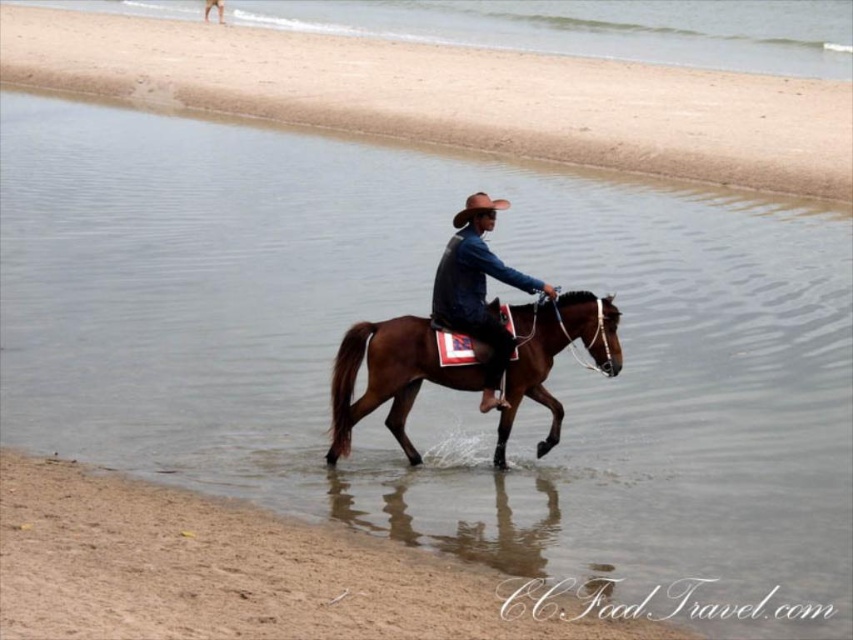
You are a photographer planning to take a photo of the scene. You want to ensure that both the brown glossy horse at center and the brown leather cowboy hat at center are clearly visible. Given their sizes, which object should you focus on first to ensure proper focus, and why?

The brown glossy horse at center has a smaller size compared to brown leather cowboy hat at center. Since the horse is smaller, it might require closer attention to ensure its details are sharp. However, focusing on the main subject, which is likely the horse, would be more important for the composition. Adjust your focus to accommodate both by prioritizing the horse while ensuring the hat remains within the depth of field.

You are standing at the point marked as point (453,97). What is the name of the location you are currently standing on?

The location you are standing on is the sandy beach at lower center, which is located at point (453,97).

You are standing at the point marked as point (x=656, y=84) on the beach. You want to walk directly towards the viewer. How far will you have to walk to reach the viewer?

The distance between point (x=656, y=84) and the viewer is 41.26 meters, so you will have to walk 41.26 meters to reach the viewer.